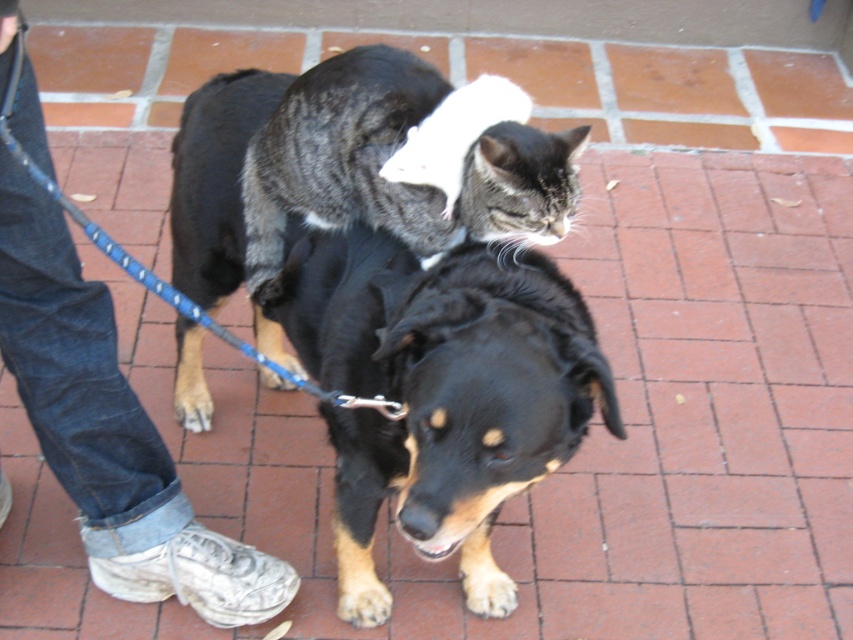
You are a photographer trying to capture a photo of the black fur dog at center and the tabby fur cat at center. Since you want to ensure both subjects are in focus, you need to know which one is taller. Can you determine which animal is taller?

The black fur dog at center has a greater height compared to the tabby fur cat at center, so the dog is taller than the cat.

You are standing at the origin point in the image. You see two points marked as point 1 at coordinates point (45,284) and point 2 at coordinates point (366,97). Which point is closer to you?

Point 2 at coordinates point (366,97) is closer to you because it is in front of point 1 at coordinates point (45,284).

You are a photographer standing at the lower left of the scene. You want to take a photo of the tabby fur cat at center without including the jeans at lower left in the frame. Considering their distance, can you position yourself appropriately to achieve this?

The jeans at lower left and tabby fur cat at center are 19.04 inches apart. By positioning yourself closer to the cat and angling the camera away from the jeans, you can frame the shot to exclude the jeans while capturing the tabby fur cat at center.